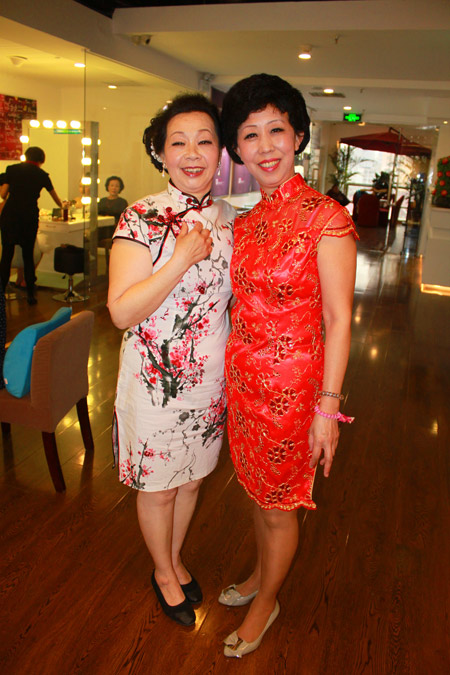
This screenshot has width=450, height=675. In order to click on brown floor in this screenshot , I will do `click(112, 628)`.